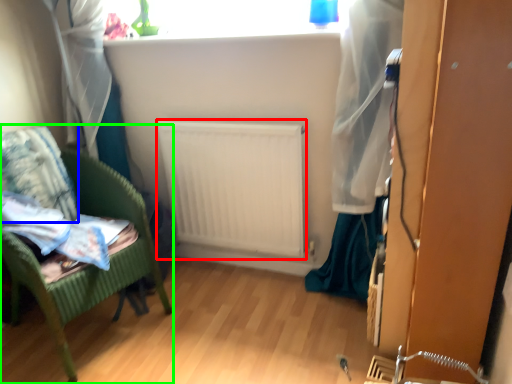
Question: Based on their relative distances, which object is nearer to radiator (highlighted by a red box)? Choose from pillow (highlighted by a blue box) and furniture (highlighted by a green box).

Choices:
 (A) pillow
 (B) furniture

Answer: (B)